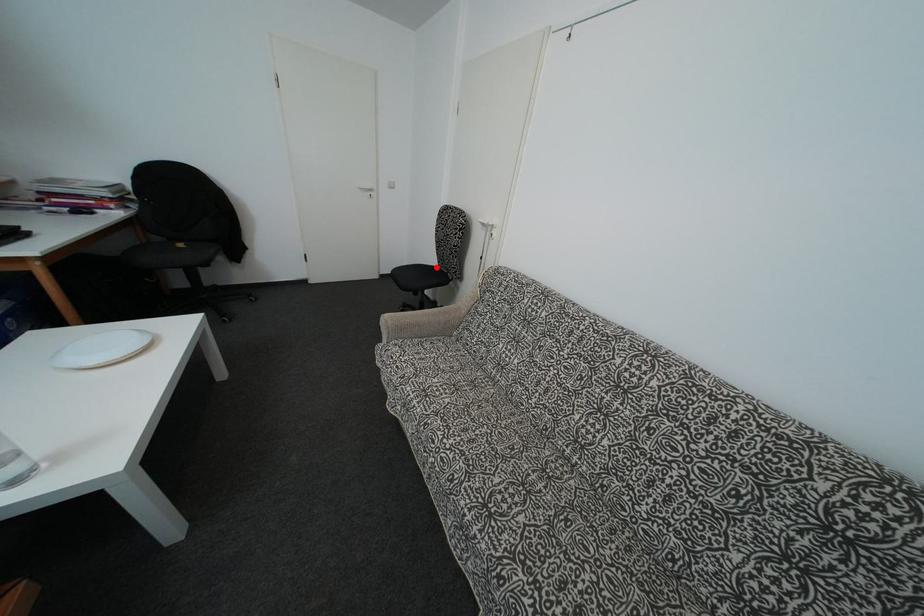
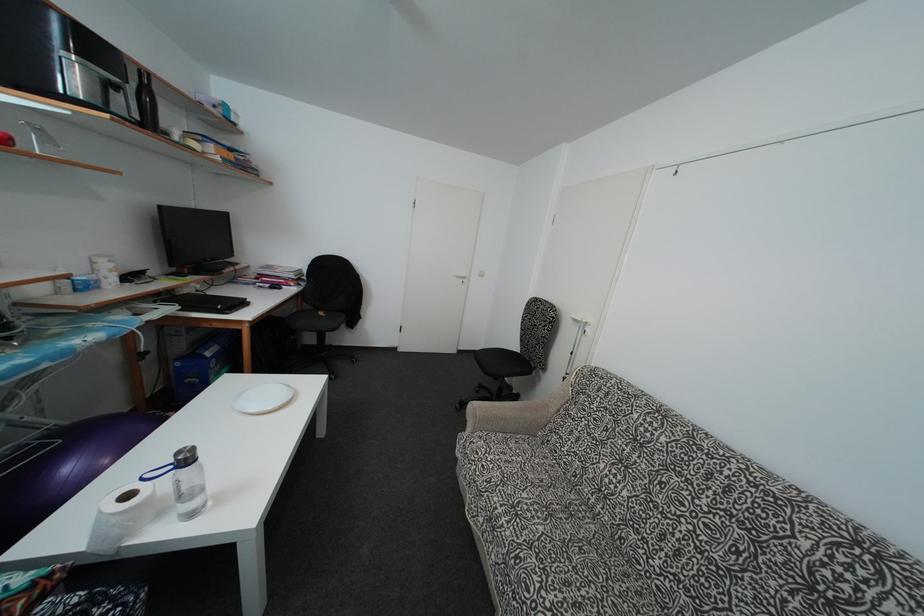
In the second image, find the point that corresponds to the highlighted location in the first image.

(517, 353)